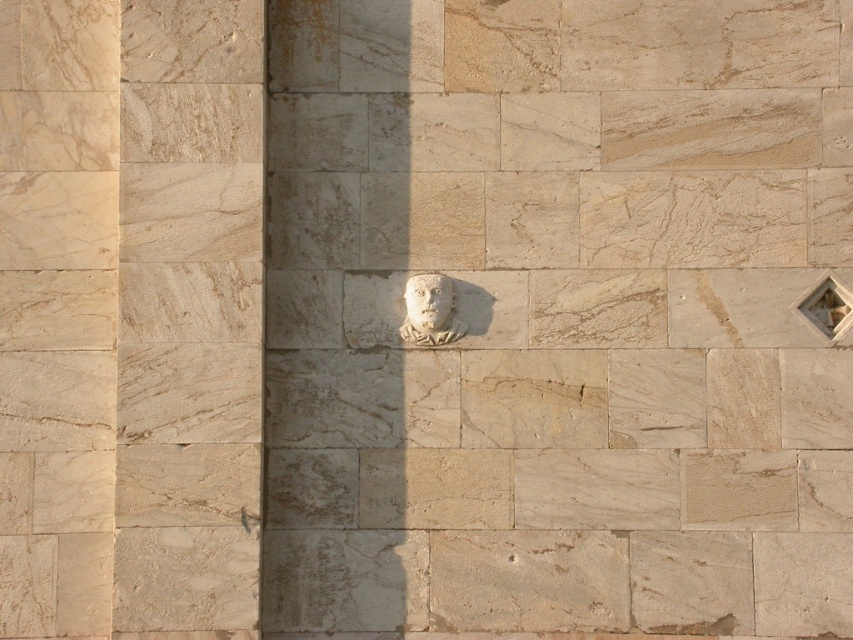
Question: Is beige marble pillar at center bigger than white stone bust at center?

Choices:
 (A) yes
 (B) no

Answer: (A)

Question: Does beige marble pillar at center appear on the right side of white stone face at center?

Choices:
 (A) no
 (B) yes

Answer: (A)

Question: Which point is closer to the camera?

Choices:
 (A) (190, 467)
 (B) (421, 308)

Answer: (A)

Question: Is beige marble pillar at center to the right of white stone face at center from the viewer's perspective?

Choices:
 (A) yes
 (B) no

Answer: (B)

Question: Considering the real-world distances, which object is closest to the beige marble pillar at center?

Choices:
 (A) white stone bust at center
 (B) white stone face at center

Answer: (A)

Question: Which of the following is the farthest from the observer?

Choices:
 (A) white stone face at center
 (B) beige marble pillar at center
 (C) white stone bust at center

Answer: (C)